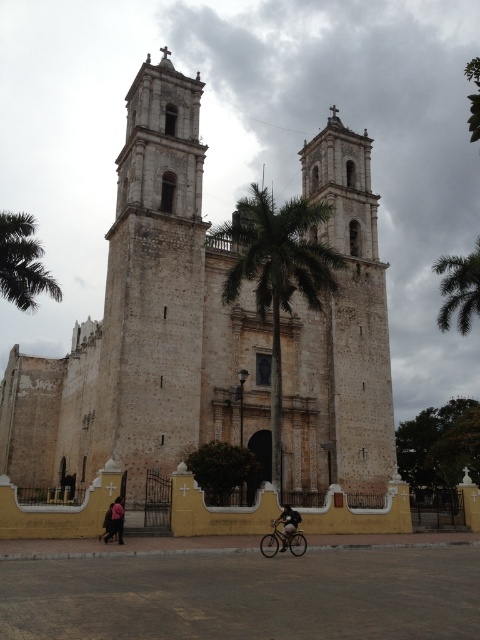
You are a photographer standing in front of the historic church. You notice a dark pink fabric at lower left and dark blue jeans at lower center in your viewfinder. Which object is positioned higher in the frame?

The dark pink fabric at lower left is positioned higher than the dark blue jeans at lower center in the frame.

You are a photographer standing in front of the historic church with two bell towers. You notice the dark pink fabric at lower left and the dark blue jeans at lower center in your view. Which object appears taller in the photo?

The dark pink fabric at lower left appears taller than the dark blue jeans at lower center in the photo.

You are standing in front of the historic church and notice a green leafy palm tree at upper right and dark blue jeans at lower center. Which object is higher in the image?

The green leafy palm tree at upper right is positioned over dark blue jeans at lower center, meaning it is higher in the image.